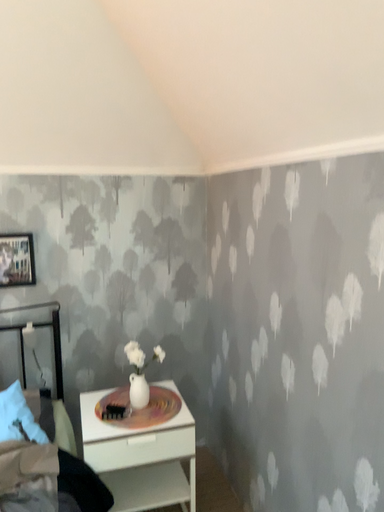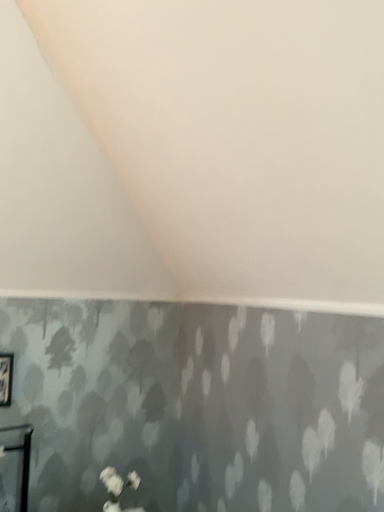
Question: Which way did the camera rotate in the video?

Choices:
 (A) rotated right
 (B) rotated left

Answer: (A)